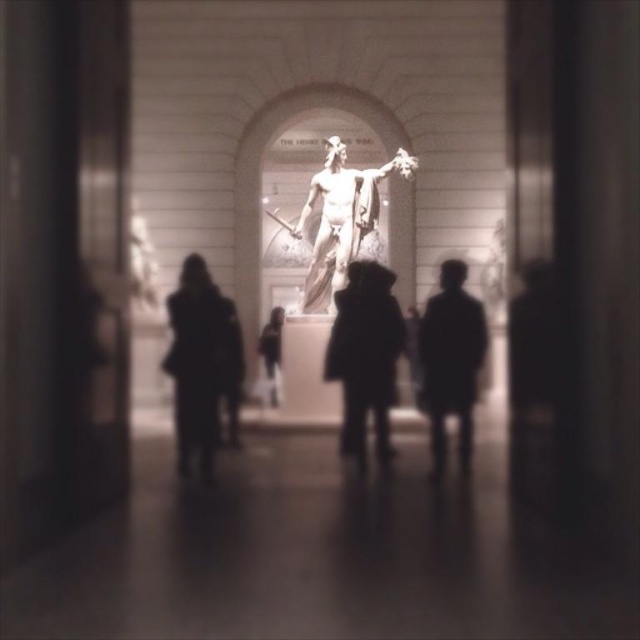
Can you confirm if black matte coat at center is positioned above polished bronze statue at center?

No.

Which is above, black matte coat at center or polished bronze statue at center?

Positioned higher is polished bronze statue at center.

The height and width of the screenshot is (640, 640). What do you see at coordinates (451, 360) in the screenshot? I see `black matte coat at center` at bounding box center [451, 360].

Locate an element on the screen. The width and height of the screenshot is (640, 640). black matte coat at center is located at coordinates (451, 360).

Can you confirm if dark matte coat at center is positioned to the right of dark fabric coat at center?

Incorrect, dark matte coat at center is not on the right side of dark fabric coat at center.

Can you confirm if dark matte coat at center is positioned above dark fabric coat at center?

No.

What do you see at coordinates (198, 360) in the screenshot? The height and width of the screenshot is (640, 640). I see `dark matte coat at center` at bounding box center [198, 360].

I want to click on dark matte coat at center, so click(x=198, y=360).

Can you confirm if dark wool coat at center is taller than dark fabric coat at center?

Indeed, dark wool coat at center has a greater height compared to dark fabric coat at center.

Which is more to the left, dark wool coat at center or dark fabric coat at center?

Positioned to the left is dark wool coat at center.

The height and width of the screenshot is (640, 640). In order to click on dark wool coat at center in this screenshot , I will do `click(230, 368)`.